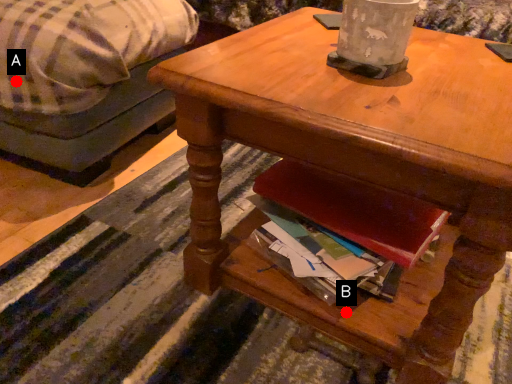
Question: Two points are circled on the image, labeled by A and B beside each circle. Among these points, which one is nearest to the camera?

Choices:
 (A) A is closer
 (B) B is closer

Answer: (B)